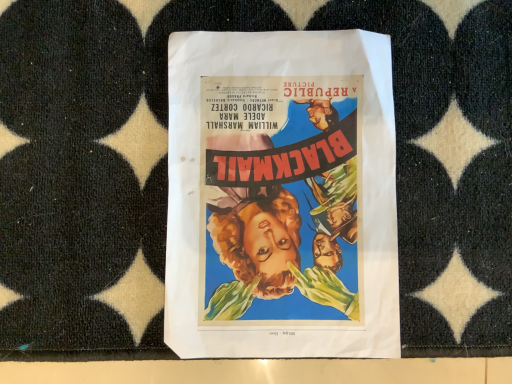
The height and width of the screenshot is (384, 512). Find the location of `free space above vibrant paper poster at center (from a real-world perspective)`. free space above vibrant paper poster at center (from a real-world perspective) is located at coordinates [x=280, y=192].